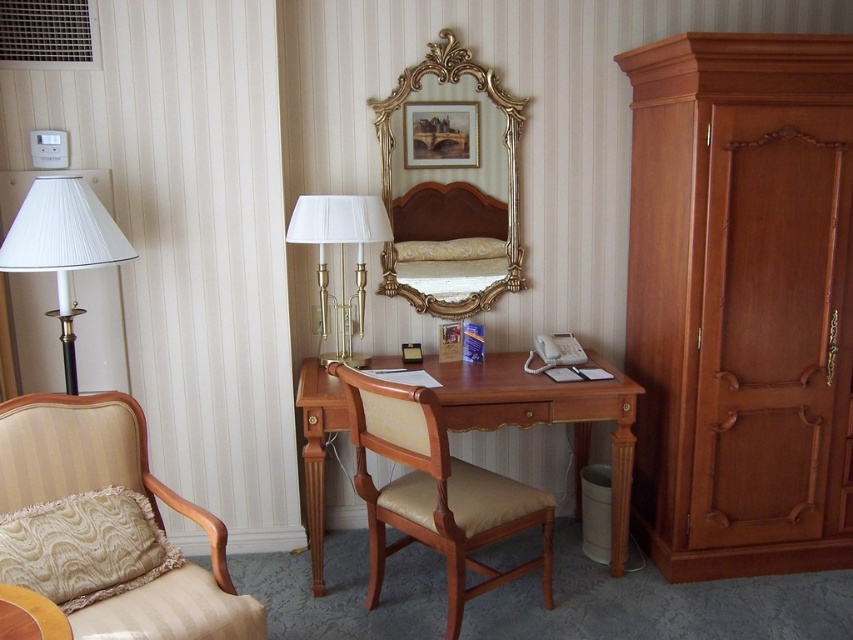
Consider the image. You are standing in the room and want to reach the point marked at coordinates point (310, 392). If your reach extends 3 feet, can you touch it without moving?

The distance between you and the point (310, 392) is 8.66 feet, which is greater than your 3 feet reach. Therefore, you cannot touch it without moving.

You are a guest in this hotel room and need to place a rectangular gift box that is 30 cm long on the wooden desk at center or the matte brass lamp at center. Based on their sizes, which object can accommodate the gift box?

The wooden desk at center can accommodate the gift box since its width is larger than the matte brass lamp at center.